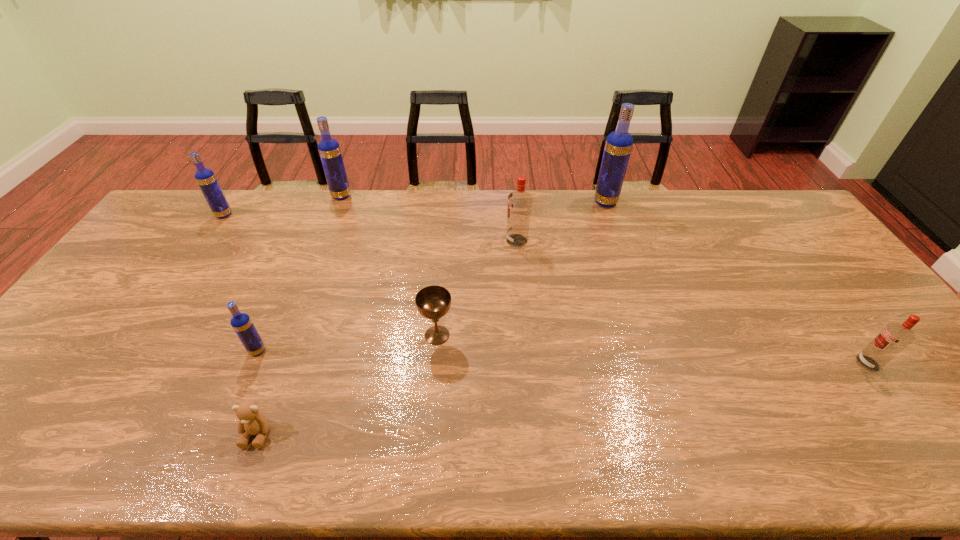
Where is `unoccupied position between the third farthest object and the seventh object from left to right`? unoccupied position between the third farthest object and the seventh object from left to right is located at coordinates point(415,208).

Find the location of a particular element. The height and width of the screenshot is (540, 960). vacant point located between the rightmost vodka and the brown teddy bear is located at coordinates (563, 399).

Locate an element on the screen. vacant space that's between the chalice and the right red vodka is located at coordinates (653, 349).

Identify the location of the sixth closest object to the rightmost vodka. (329, 150).

At what (x,y) coordinates should I click in order to perform the action: click on object that is the sixth closest to the second object from left to right. Please return your answer as a coordinate pair (x, y). The image size is (960, 540). Looking at the image, I should click on (619, 143).

Select which vodka appears as the fourth closest to the shortest object. Please provide its 2D coordinates. Your answer should be formatted as a tuple, i.e. [(x, y)], where the tuple contains the x and y coordinates of a point satisfying the conditions above.

[(329, 150)]

Where is `vodka that is the fifth closest to the seventh shortest object`? This screenshot has width=960, height=540. vodka that is the fifth closest to the seventh shortest object is located at coordinates (894, 337).

Locate which blue vodka is the fourth closest to the left red vodka. Please provide its 2D coordinates. Your answer should be formatted as a tuple, i.e. [(x, y)], where the tuple contains the x and y coordinates of a point satisfying the conditions above.

[(205, 177)]

You are a GUI agent. You are given a task and a screenshot of the screen. Output one action in this format:
    pyautogui.click(x=<x>, y=<y>)
    Task: Click on the blue vodka that is the closest to the third nearest vodka
    This screenshot has height=540, width=960.
    Given the screenshot: What is the action you would take?
    pyautogui.click(x=619, y=143)

Locate an element on the screen. The image size is (960, 540). free spot that satisfies the following two spatial constraints: 1. on the back side of the chalice; 2. on the right side of the second vodka from left to right is located at coordinates (264, 335).